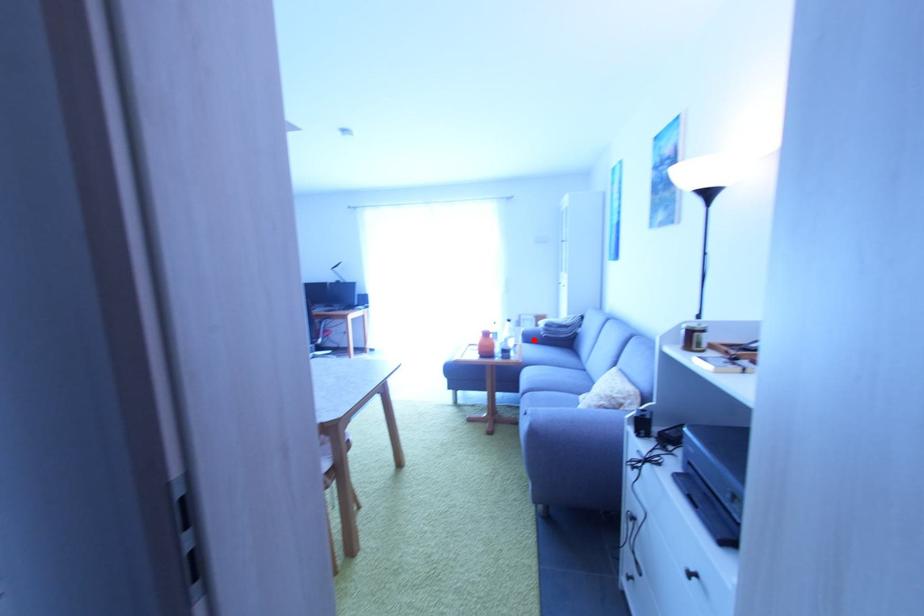
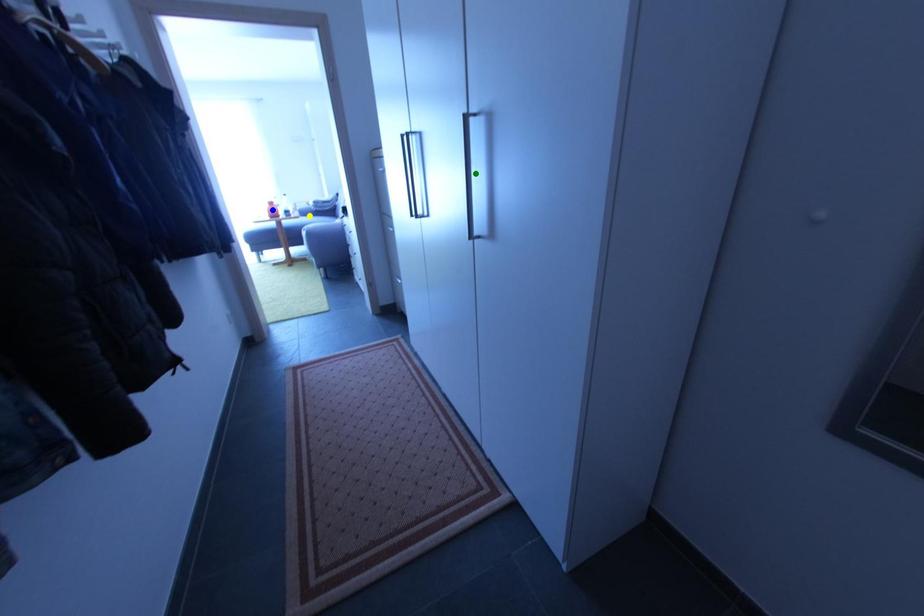
Question: I am providing you with two images of the same scene from different viewpoints. A red point is marked on the first image. You are given multiple points on the second image. Which point in image 2 is actually the same real-world point as the red point in image 1?

Choices:
 (A) yellow point
 (B) green point
 (C) blue point

Answer: (A)